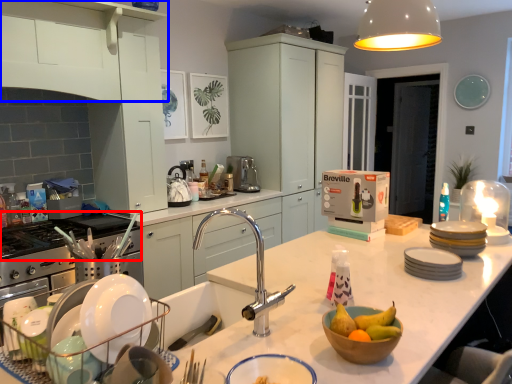
Question: Which object appears closest to the camera in this image, gas stove (highlighted by a red box) or cabinetry (highlighted by a blue box)?

Choices:
 (A) gas stove
 (B) cabinetry

Answer: (B)